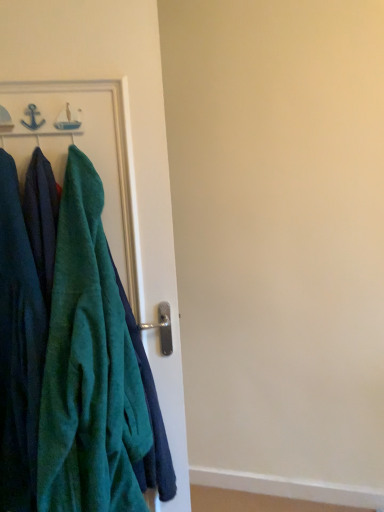
Question: From the image's perspective, does velvety green towel at left appear higher than velvety green robe at left?

Choices:
 (A) no
 (B) yes

Answer: (A)

Question: Can you confirm if velvety green towel at left is taller than velvety green robe at left?

Choices:
 (A) yes
 (B) no

Answer: (A)

Question: Is velvety green towel at left outside velvety green robe at left?

Choices:
 (A) yes
 (B) no

Answer: (A)

Question: Does velvety green towel at left have a lesser width compared to velvety green robe at left?

Choices:
 (A) no
 (B) yes

Answer: (A)

Question: Is velvety green towel at left at the left side of velvety green robe at left?

Choices:
 (A) yes
 (B) no

Answer: (B)

Question: Is velvety green towel at left in front of velvety green robe at left?

Choices:
 (A) yes
 (B) no

Answer: (A)

Question: Can you confirm if velvety green robe at left is positioned to the left of velvety green towel at left?

Choices:
 (A) no
 (B) yes

Answer: (B)

Question: Can you confirm if velvety green robe at left is smaller than velvety green towel at left?

Choices:
 (A) yes
 (B) no

Answer: (A)

Question: From the image's perspective, is velvety green robe at left on velvety green towel at left?

Choices:
 (A) no
 (B) yes

Answer: (B)

Question: Is velvety green robe at left turned away from velvety green towel at left?

Choices:
 (A) yes
 (B) no

Answer: (B)

Question: Can you confirm if velvety green robe at left is thinner than velvety green towel at left?

Choices:
 (A) yes
 (B) no

Answer: (A)

Question: Is velvety green towel at left completely or partially inside velvety green robe at left?

Choices:
 (A) no
 (B) yes

Answer: (A)

Question: Do you think velvety green towel at left is within velvety green robe at left, or outside of it?

Choices:
 (A) inside
 (B) outside

Answer: (B)